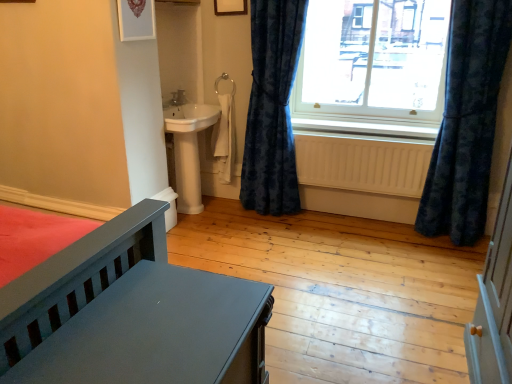
The image size is (512, 384). In order to click on free spot above white painted wood at lower center (from a real-world perspective) in this screenshot , I will do `click(356, 117)`.